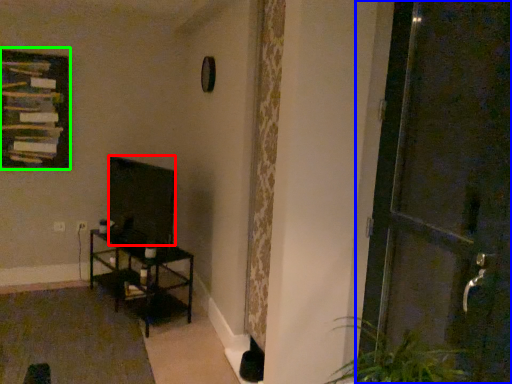
Question: Based on their relative distances, which object is nearer to wide (highlighted by a red box)? Choose from door (highlighted by a blue box) and picture frame (highlighted by a green box).

Choices:
 (A) door
 (B) picture frame

Answer: (B)